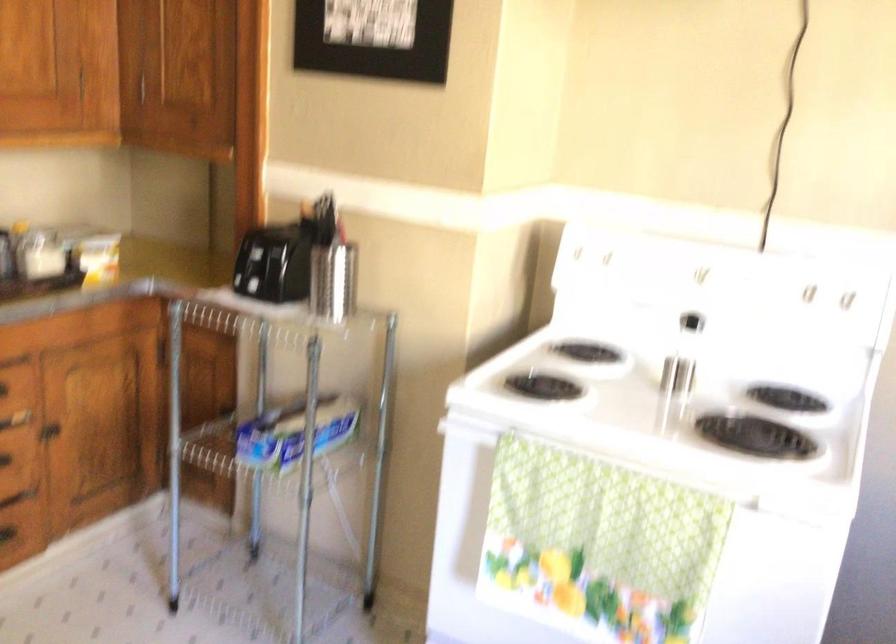
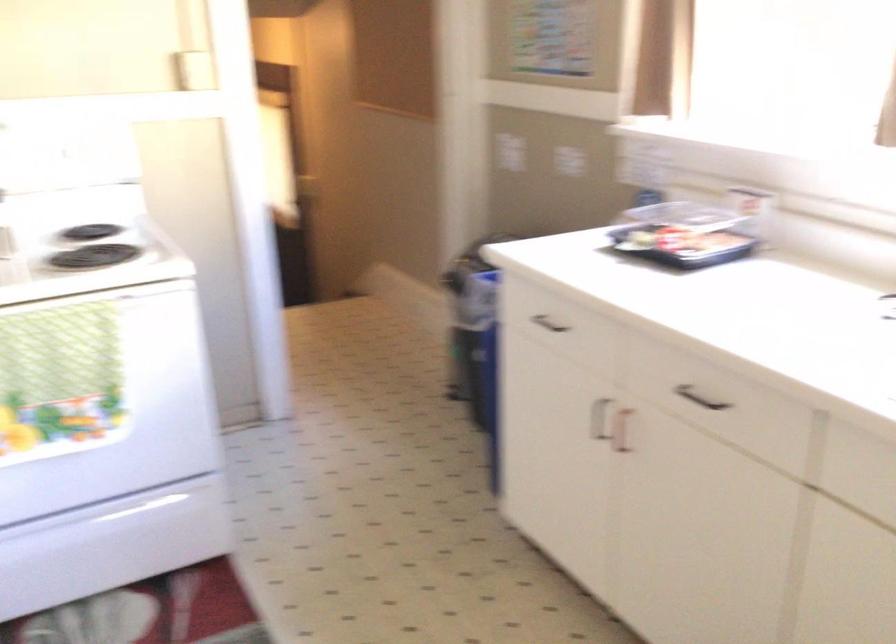
Question: The camera is either moving clockwise (left) or counter-clockwise (right) around the object. The first image is from the beginning of the video and the second image is from the end. Is the camera moving left or right when shooting the video?

Choices:
 (A) Left
 (B) Right

Answer: (A)